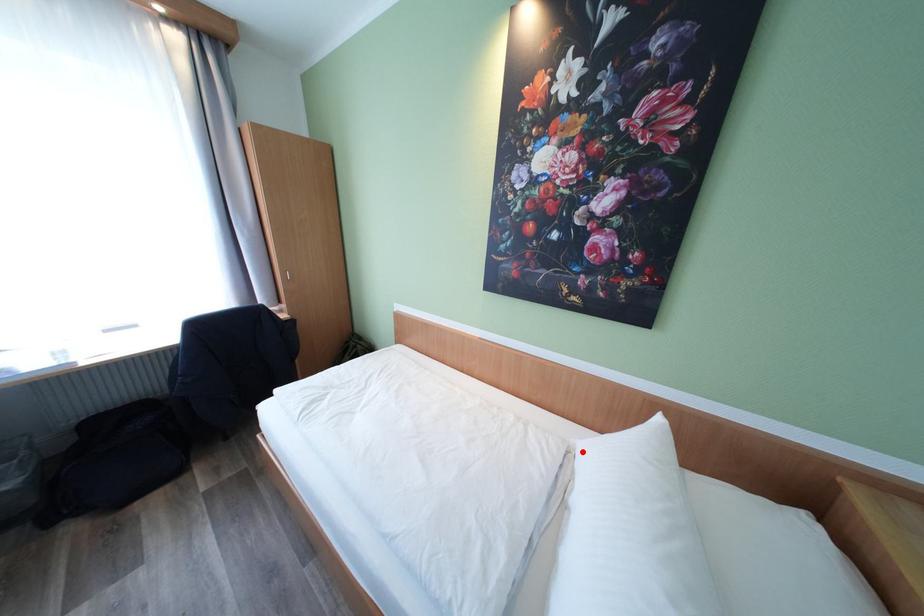
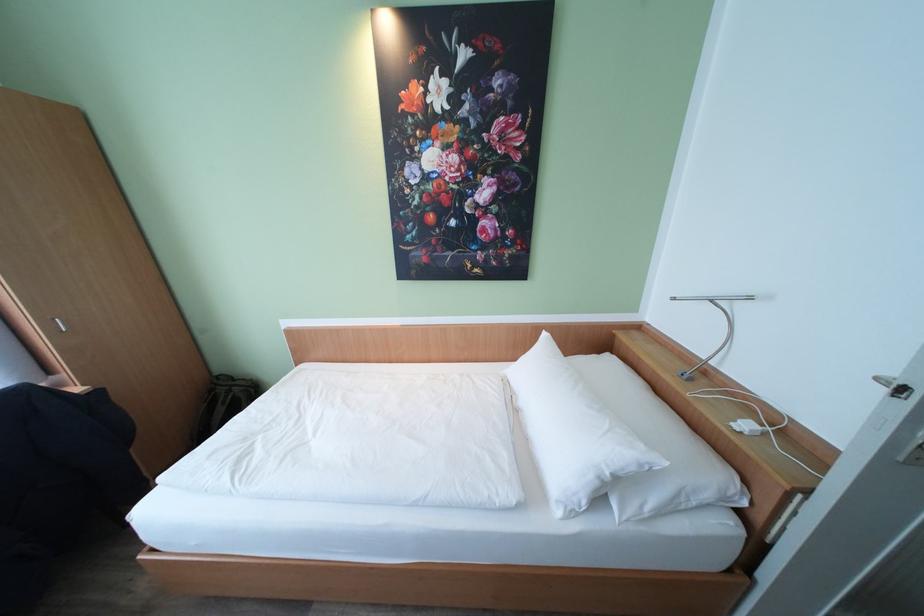
Find the pixel in the second image that matches the highlighted location in the first image.

(513, 379)